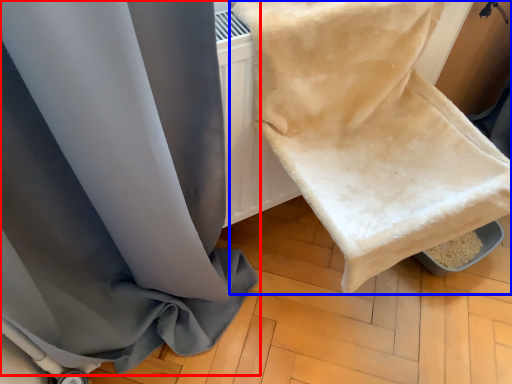
Question: Among these objects, which one is farthest to the camera, curtain (highlighted by a red box) or towel (highlighted by a blue box)?

Choices:
 (A) curtain
 (B) towel

Answer: (B)